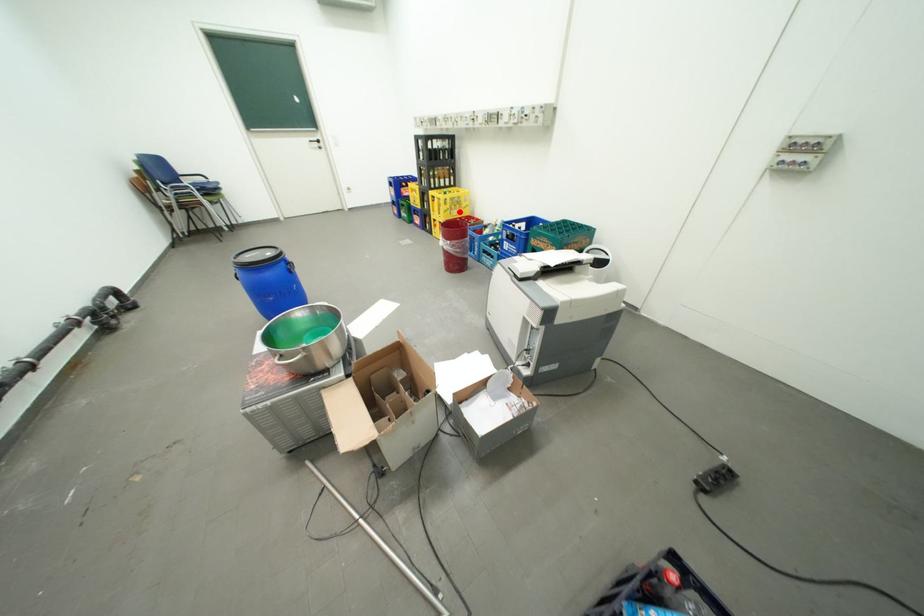
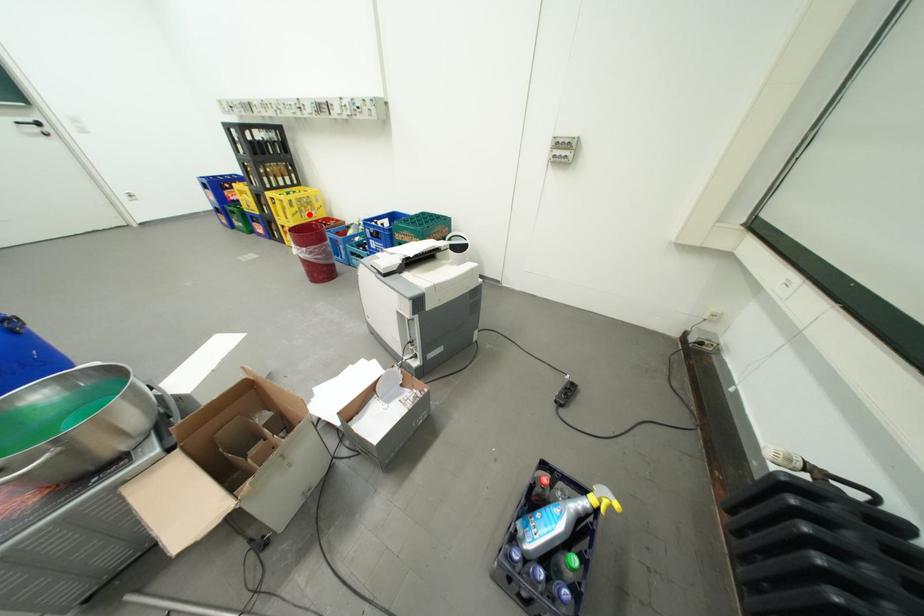
I am providing you with two images of the same scene from different viewpoints. A red point is marked on the first image and another point is marked on the second image. Do the highlighted points in image1 and image2 indicate the same real-world spot?

Yes